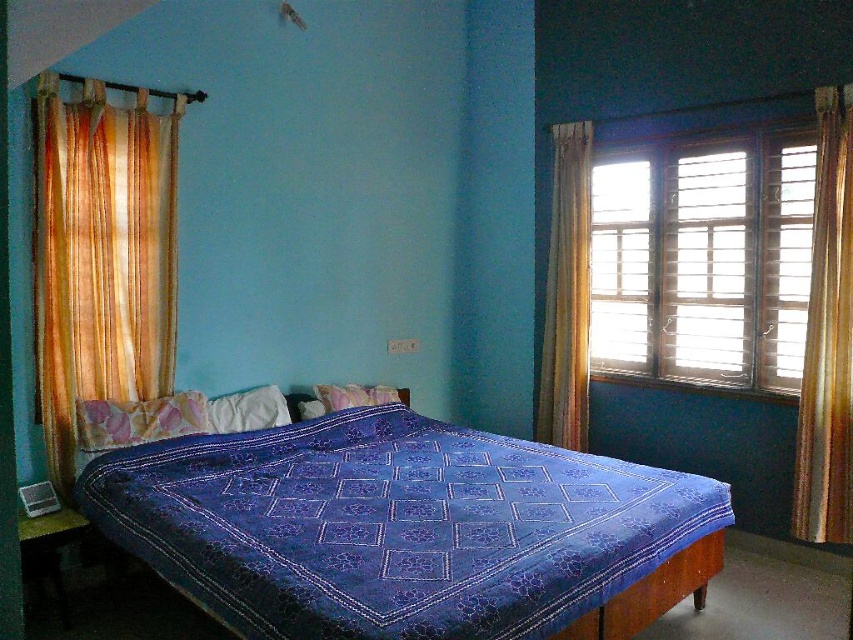
Question: Which object is the closest to the wooden slats at right?

Choices:
 (A) orange sheer curtain at right
 (B) blue printed fabric at center

Answer: (A)

Question: Which of these objects is positioned farthest from the wooden slats at right?

Choices:
 (A) blue printed fabric at center
 (B) pink fabric pillow at center
 (C) orange sheer curtain at left

Answer: (C)

Question: Which point is farther to the camera?

Choices:
 (A) (270, 461)
 (B) (799, 406)
 (C) (94, 161)
 (D) (285, 412)

Answer: (D)

Question: Can you confirm if wooden slats at right is positioned below orange striped curtain at right?

Choices:
 (A) no
 (B) yes

Answer: (A)

Question: Is wooden slats at right further to the viewer compared to orange striped curtain at right?

Choices:
 (A) no
 (B) yes

Answer: (A)

Question: Can you confirm if orange sheer curtain at right is wider than purple fabric pillow at center?

Choices:
 (A) yes
 (B) no

Answer: (B)